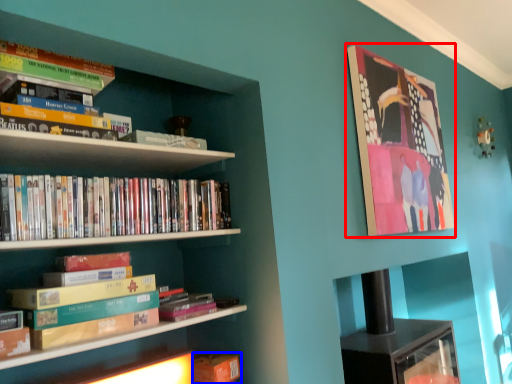
Question: Among these objects, which one is nearest to the camera, picture frame (highlighted by a red box) or book (highlighted by a blue box)?

Choices:
 (A) picture frame
 (B) book

Answer: (B)